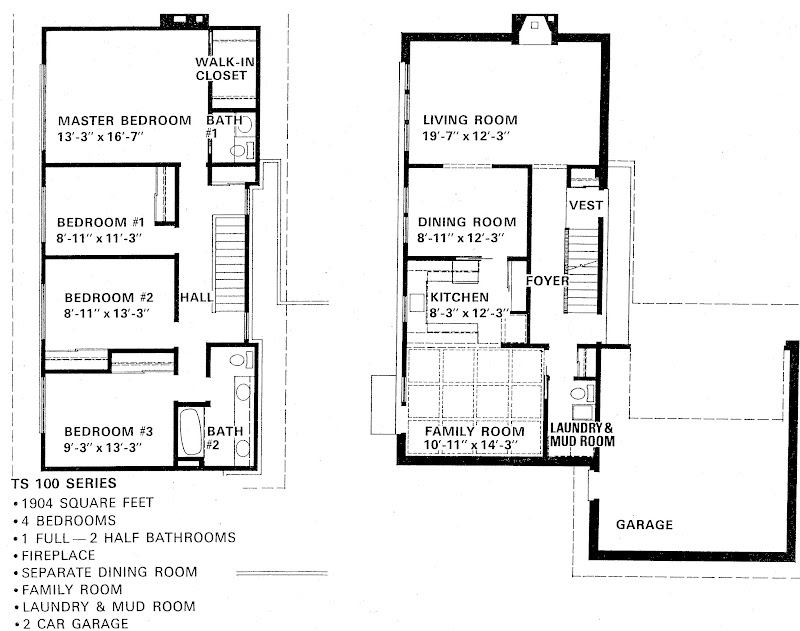
The width and height of the screenshot is (800, 631). Find the location of `bedrooms`. bedrooms is located at coordinates (118, 59), (106, 186), (102, 292), (90, 398).